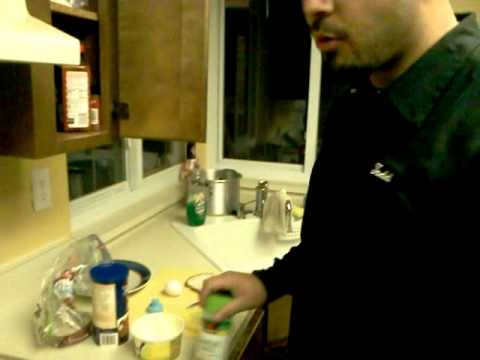
Identify the location of faucet. The height and width of the screenshot is (360, 480). (261, 196).